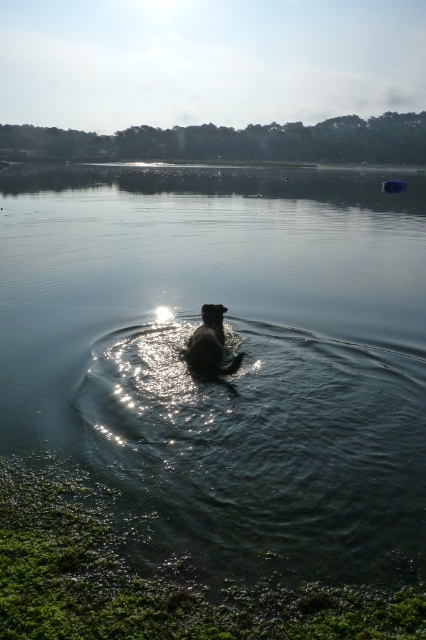
Question: Is clear water at center bigger than shiny brown dog at center?

Choices:
 (A) yes
 (B) no

Answer: (A)

Question: Which object appears closest to the camera in this image?

Choices:
 (A) clear water at center
 (B) shiny brown dog at center

Answer: (A)

Question: Does clear water at center appear over shiny brown dog at center?

Choices:
 (A) no
 (B) yes

Answer: (B)

Question: Does clear water at center appear over shiny brown dog at center?

Choices:
 (A) no
 (B) yes

Answer: (B)

Question: Which point is closer to the camera?

Choices:
 (A) (259, 524)
 (B) (215, 339)

Answer: (A)